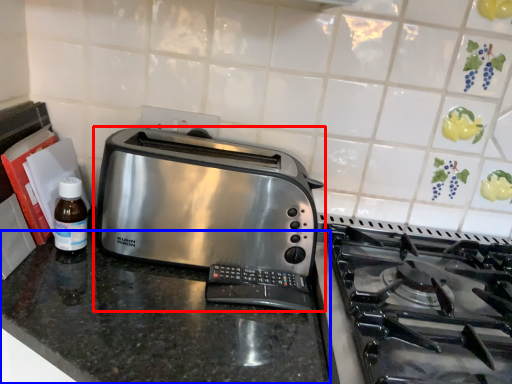
Question: Which point is further to the camera, toaster (highlighted by a red box) or counter (highlighted by a blue box)?

Choices:
 (A) toaster
 (B) counter

Answer: (A)